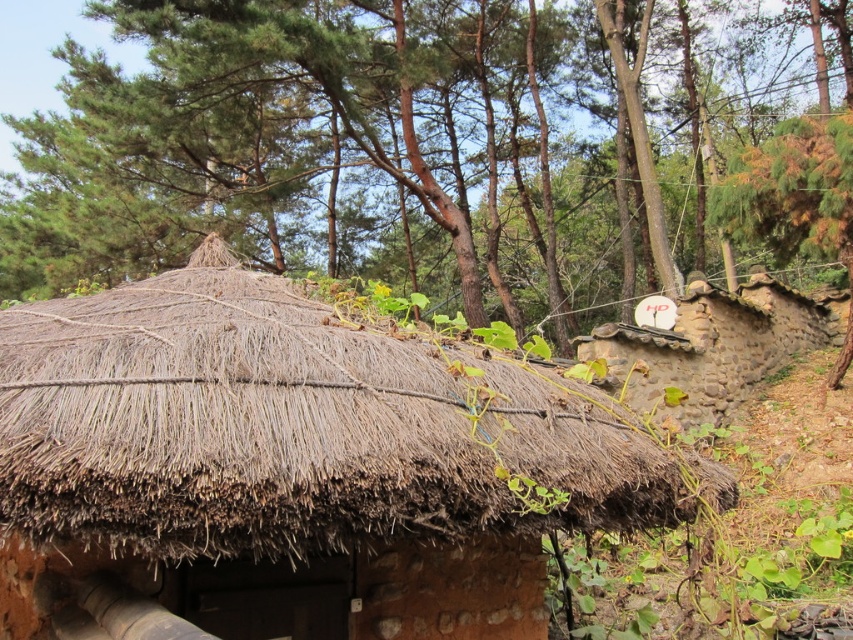
Question: Is brown thatch roof at upper center wider than brown thatch roof at center?

Choices:
 (A) yes
 (B) no

Answer: (A)

Question: Which object appears farthest from the camera in this image?

Choices:
 (A) brown stone hut at upper right
 (B) brown thatch roof at center

Answer: (A)

Question: Which point is closer to the camera taking this photo?

Choices:
 (A) click(x=801, y=324)
 (B) click(x=169, y=61)

Answer: (B)

Question: Among these points, which one is nearest to the camera?

Choices:
 (A) (44, 481)
 (B) (682, 378)
 (C) (412, 205)

Answer: (A)

Question: Can you confirm if brown thatch roof at upper center is positioned to the left of brown stone hut at upper right?

Choices:
 (A) no
 (B) yes

Answer: (B)

Question: Is brown thatch roof at upper center thinner than brown thatch roof at center?

Choices:
 (A) yes
 (B) no

Answer: (B)